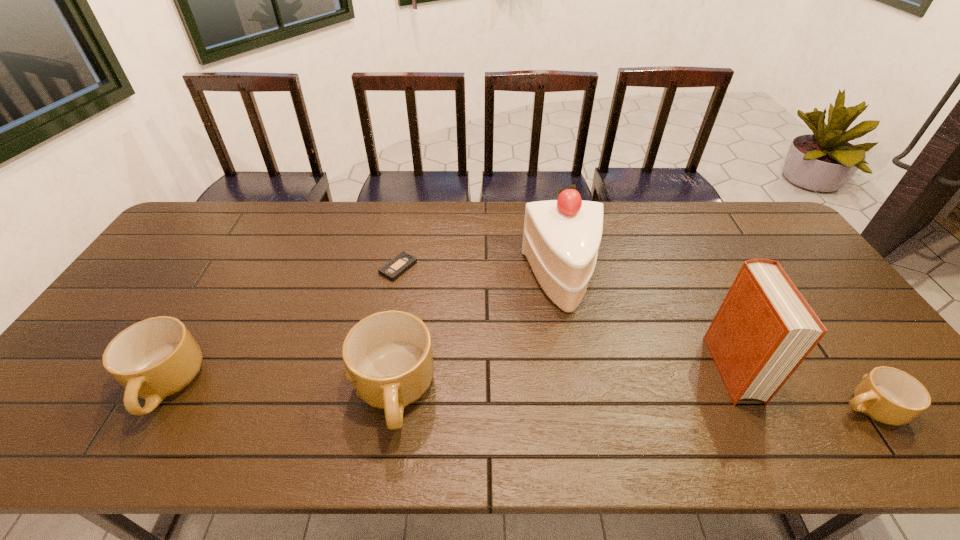
If equal spacing is desired by inserting an extra mug among them, please point out a free spot for this new mug. Please provide its 2D coordinates. Your answer should be formatted as a tuple, i.e. [(x, y)], where the tuple contains the x and y coordinates of a point satisfying the conditions above.

[(628, 401)]